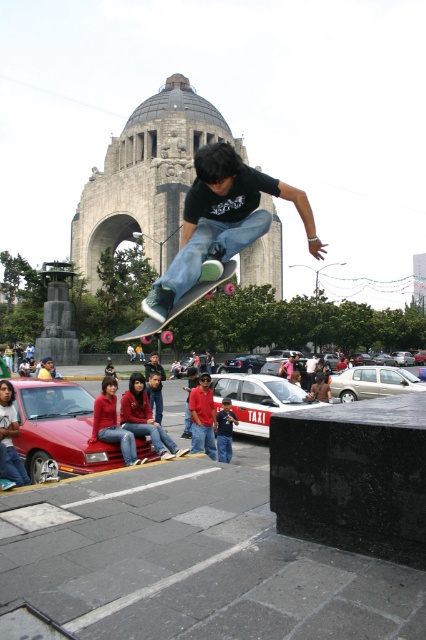
Between point (203, 403) and point (216, 444), which one is positioned in front?

Point (216, 444) is in front.

Does red cotton shirt at center have a lesser width compared to blue denim jeans at center?

No, red cotton shirt at center is not thinner than blue denim jeans at center.

Does point (209, 397) come behind point (233, 422)?

No, (209, 397) is in front of (233, 422).

Find the location of a particular element. The image size is (426, 640). red cotton shirt at center is located at coordinates (203, 417).

Who is lower down, matte black skateboard at center or red cotton shirt at center?

red cotton shirt at center is lower down.

Does matte black skateboard at center appear over red cotton shirt at center?

Yes, matte black skateboard at center is above red cotton shirt at center.

Between point (186, 264) and point (201, 372), which one is positioned behind?

The point (201, 372) is more distant.

At what (x,y) coordinates should I click in order to perform the action: click on matte black skateboard at center. Please return your answer as a coordinate pair (x, y). This screenshot has height=640, width=426. Looking at the image, I should click on (221, 221).

Does pink rubber wheels skateboard at center have a smaller size compared to blue denim jeans at center?

Incorrect, pink rubber wheels skateboard at center is not smaller in size than blue denim jeans at center.

Describe the element at coordinates (178, 305) in the screenshot. I see `pink rubber wheels skateboard at center` at that location.

The height and width of the screenshot is (640, 426). I want to click on pink rubber wheels skateboard at center, so click(x=178, y=305).